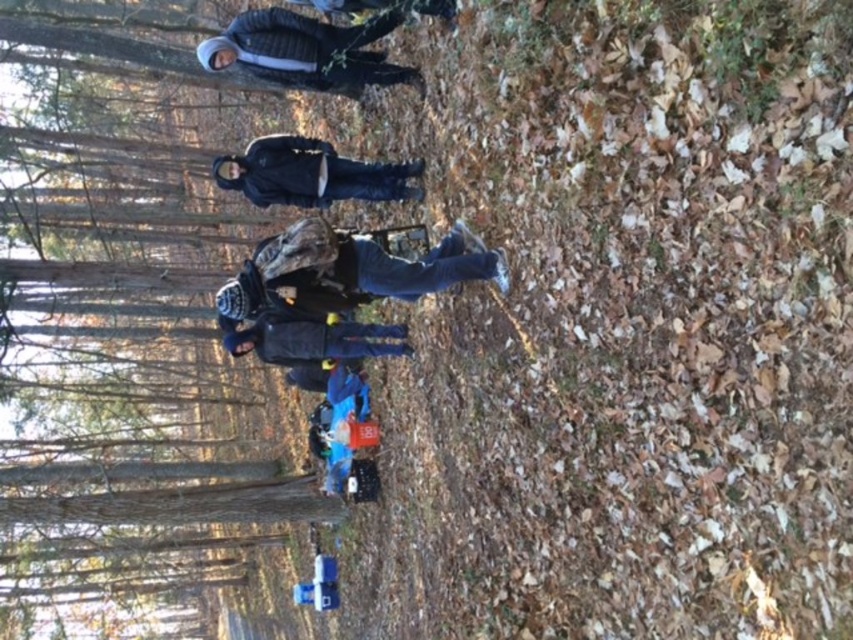
Which is above, brown wood tree at upper center or black matte jacket at center?

black matte jacket at center is above.

Is brown wood tree at upper center above black matte jacket at center?

No, brown wood tree at upper center is not above black matte jacket at center.

Describe the element at coordinates (125, 324) in the screenshot. I see `brown wood tree at upper center` at that location.

This screenshot has height=640, width=853. I want to click on brown wood tree at upper center, so click(125, 324).

Can you confirm if brown wood tree at upper center is positioned below brushed metal jacket at upper center?

Correct, brown wood tree at upper center is located below brushed metal jacket at upper center.

At what (x,y) coordinates should I click in order to perform the action: click on brown wood tree at upper center. Please return your answer as a coordinate pair (x, y). Image resolution: width=853 pixels, height=640 pixels. Looking at the image, I should click on (125, 324).

Is point (424, 260) farther from camera compared to point (299, 168)?

That is False.

Between point (492, 257) and point (317, 156), which one is positioned in front?

Point (492, 257)

Which is behind, point (346, 248) or point (308, 177)?

Point (308, 177)

The image size is (853, 640). I want to click on camouflage jacket at center, so click(350, 269).